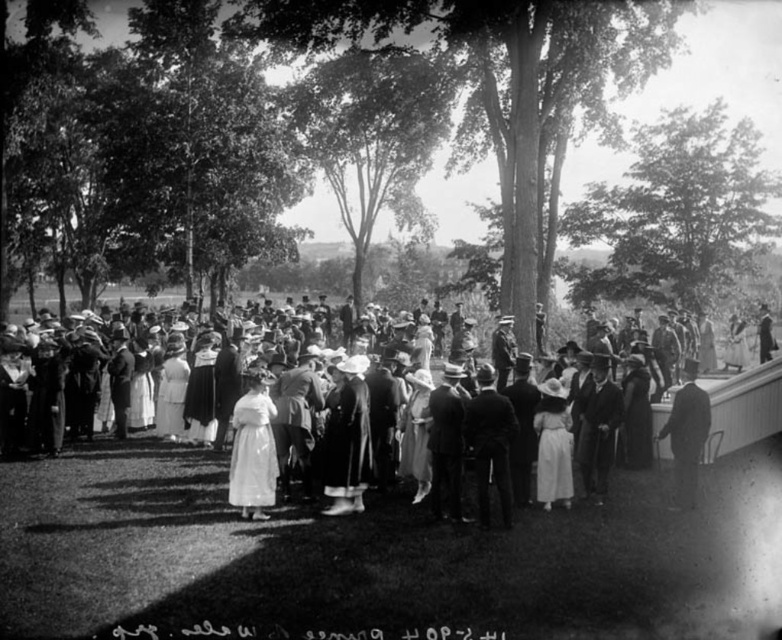
Is white cotton dress at center above smooth black suit at right?

Correct, white cotton dress at center is located above smooth black suit at right.

The image size is (782, 640). I want to click on white cotton dress at center, so click(144, 496).